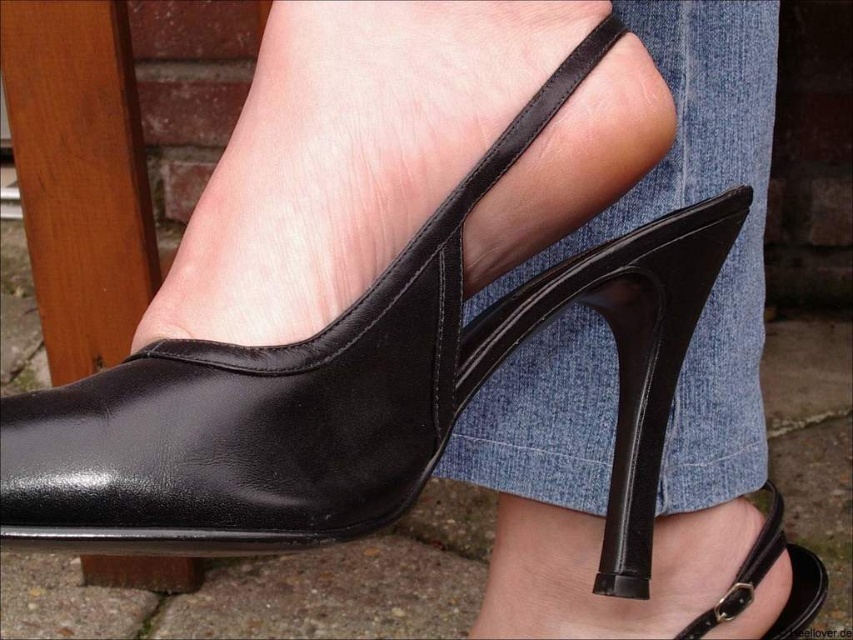
You are designing a virtual reality environment and need to place a decorative mat exactly where the black leather shoe at center is positioned. According to the coordinates provided, where should you place the mat?

The black leather shoe at center is located at point [296,371], so the decorative mat should be placed at those coordinates to match the shoe position.